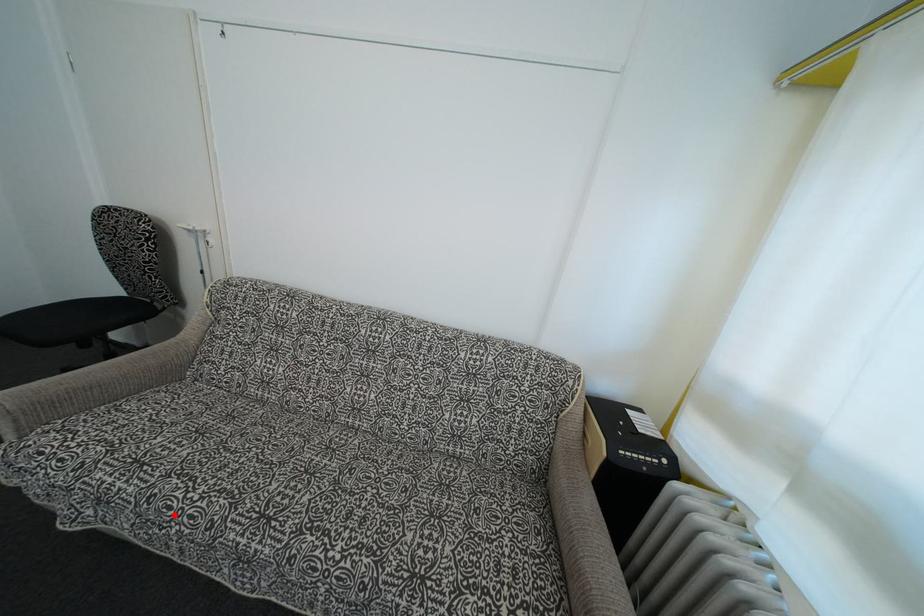
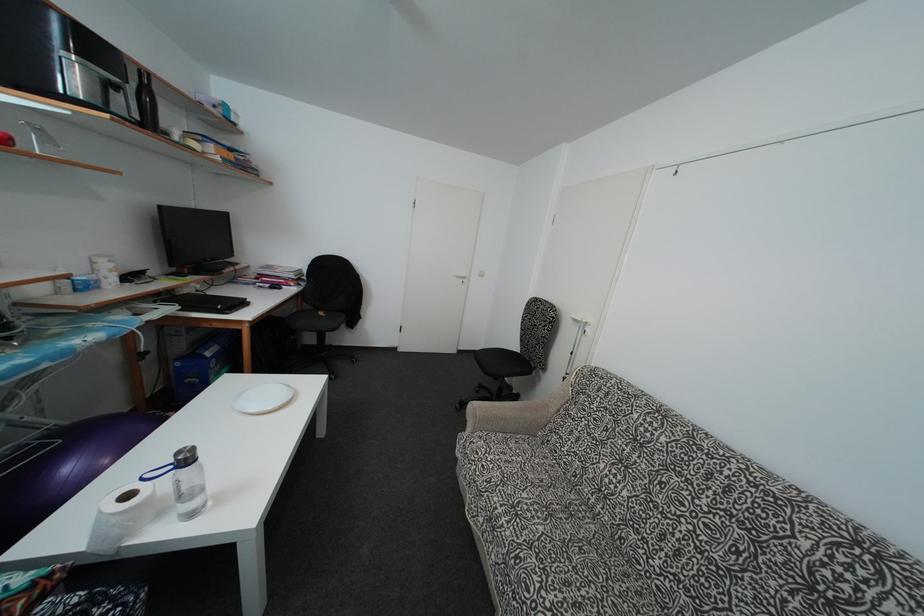
Question: A red point is marked in image1. In image2, is the corresponding 3D point closer to the camera or farther? Reply with the corresponding letter.

Choices:
 (A) The corresponding 3D point is closer.
 (B) The corresponding 3D point is farther.

Answer: (B)